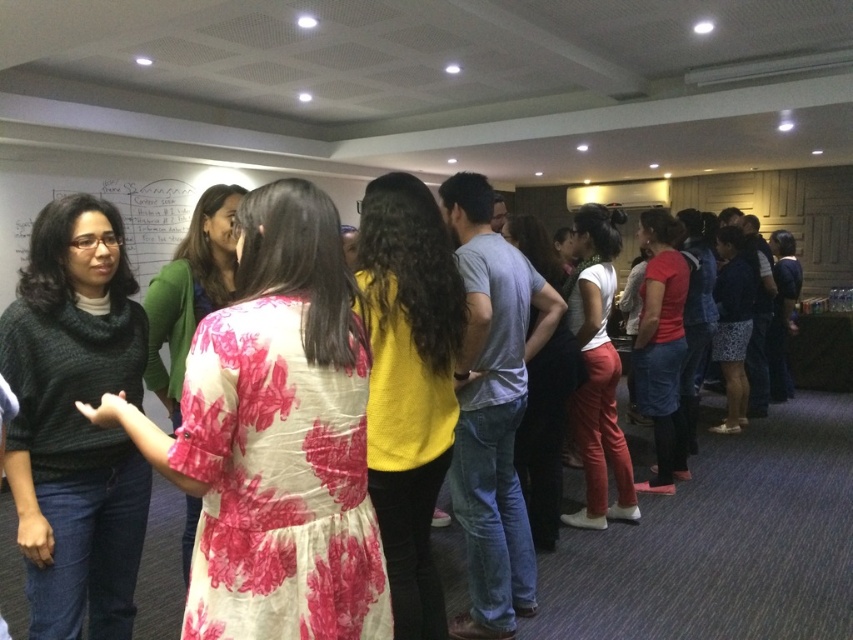
You are an event organizer who needs to arrange chairs for a small gathering in this room. The chairs are 0.5 meters wide each. If you want to place two chairs between the floral fabric dress at center and the matte yellow shirt at center, will there be enough space?

The distance between the floral fabric dress at center and the matte yellow shirt at center is 1.43 meters. Each chair is 0.5 meters wide, so two chairs would require 1 meter of space. Since 1.43 meters is greater than 1 meter, there is enough space to place the two chairs between them.